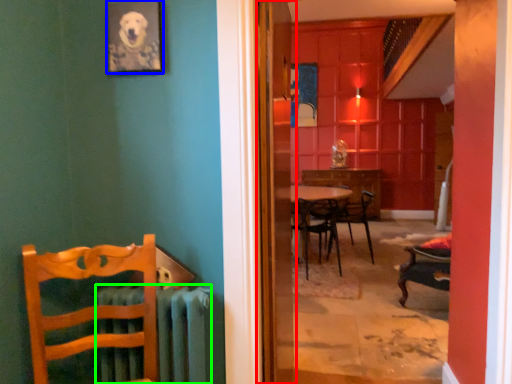
Question: Which object is the closest to the screen door (highlighted by a red box)? Choose among these: picture frame (highlighted by a blue box) or radiator (highlighted by a green box).

Choices:
 (A) picture frame
 (B) radiator

Answer: (B)